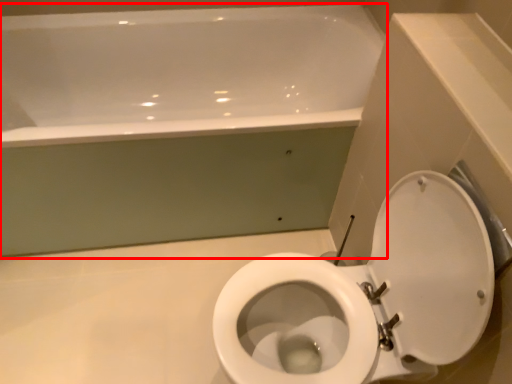
Question: Observing the image, what is the correct spatial positioning of bathtub (annotated by the red box) in reference to toilet?

Choices:
 (A) left
 (B) right

Answer: (A)